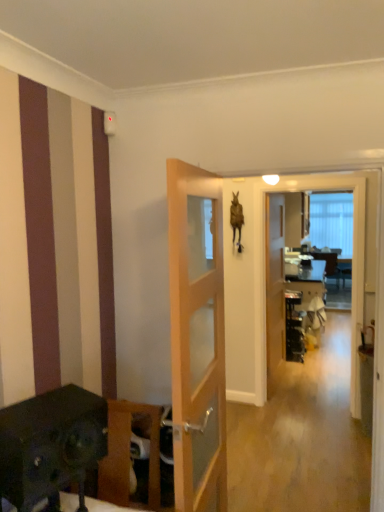
Measure the distance between point (215,317) and camera.

The depth of point (215,317) is 6.95 feet.

This screenshot has height=512, width=384. I want to click on wooden door at center, placed as the first door when sorted from back to front, so click(x=275, y=281).

Locate an element on the screen. The height and width of the screenshot is (512, 384). wooden cabinet at lower left is located at coordinates (128, 454).

Can you confirm if wooden door at center, the second door from the left, is wider than wooden cabinet at lower left?

Incorrect, the width of wooden door at center, the second door from the left, does not surpass that of wooden cabinet at lower left.

Is wooden door at center, placed as the first door when sorted from back to front, next to wooden cabinet at lower left?

No, wooden door at center, placed as the first door when sorted from back to front, is not beside wooden cabinet at lower left.

Is wooden door at center, placed as the first door when sorted from back to front, positioned with its back to wooden cabinet at lower left?

That's not correct — wooden door at center, placed as the first door when sorted from back to front, is not looking away from wooden cabinet at lower left.

Is light wood/glass door at center, marked as the first door in a left-to-right arrangement, facing towards transparent glass screen door at center?

No, light wood/glass door at center, marked as the first door in a left-to-right arrangement, is not aimed at transparent glass screen door at center.

This screenshot has width=384, height=512. Find the location of `the 2nd door to the left of the transparent glass screen door at center, counting from the anchor's position`. the 2nd door to the left of the transparent glass screen door at center, counting from the anchor's position is located at coordinates (197, 336).

From the picture: Between light wood/glass door at center, which is counted as the 2th door, starting from the right, and transparent glass screen door at center, which one appears on the right side from the viewer's perspective?

transparent glass screen door at center.

Would you say light wood/glass door at center, the 1th door when ordered from front to back, is inside or outside transparent glass screen door at center?

The correct answer is: outside.

Which of these two, wooden door at center, positioned as the 2th door in front-to-back order, or light wood/glass door at center, which appears as the second door when viewed from the back, is smaller?

wooden door at center, positioned as the 2th door in front-to-back order.

From a real-world perspective, relative to light wood/glass door at center, marked as the first door in a left-to-right arrangement, is wooden door at center, positioned as the 2th door in front-to-back order, vertically above or below?

Clearly, from a real-world perspective, wooden door at center, positioned as the 2th door in front-to-back order, is below light wood/glass door at center, marked as the first door in a left-to-right arrangement.

Between wooden door at center, placed as the first door when sorted from back to front, and light wood/glass door at center, which is counted as the 2th door, starting from the right, which one has more height?

wooden door at center, placed as the first door when sorted from back to front.

Looking at this image, can you tell me how much wooden door at center, placed as the first door when sorted from back to front, and light wood/glass door at center, the 1th door when ordered from front to back, differ in facing direction?

wooden door at center, placed as the first door when sorted from back to front, and light wood/glass door at center, the 1th door when ordered from front to back, are facing 11.3 degrees away from each other.

Is wooden door at center, positioned as the 2th door in front-to-back order, oriented away from transparent glass screen door at center?

No, wooden door at center, positioned as the 2th door in front-to-back order,'s orientation is not away from transparent glass screen door at center.

How different are the orientations of wooden door at center, the second door from the left, and transparent glass screen door at center in degrees?

wooden door at center, the second door from the left, and transparent glass screen door at center are facing 84.2 degrees away from each other.

Is point (280, 329) farther from viewer compared to point (362, 319)?

Yes, it is.

From a real-world perspective, which is physically below, wooden door at center, the 1th door positioned from the right, or transparent glass screen door at center?

From a 3D spatial view, wooden door at center, the 1th door positioned from the right, is below.

From a real-world perspective, who is located higher, wooden cabinet at lower left or light wood/glass door at center, marked as the first door in a left-to-right arrangement?

light wood/glass door at center, marked as the first door in a left-to-right arrangement, is physically above.

Does wooden cabinet at lower left appear on the right side of light wood/glass door at center, the 1th door when ordered from front to back?

Incorrect, wooden cabinet at lower left is not on the right side of light wood/glass door at center, the 1th door when ordered from front to back.

Is wooden cabinet at lower left looking in the opposite direction of light wood/glass door at center, the 1th door when ordered from front to back?

That's not correct — wooden cabinet at lower left is not looking away from light wood/glass door at center, the 1th door when ordered from front to back.

Identify the location of furniture behind the light wood/glass door at center, which appears as the second door when viewed from the back. This screenshot has width=384, height=512. (128, 454).

Based on the photo, could you measure the distance between wooden cabinet at lower left and wooden door at center, the 1th door positioned from the right?

wooden cabinet at lower left is 2.64 meters from wooden door at center, the 1th door positioned from the right.

I want to click on furniture on the left of the wooden door at center, positioned as the 2th door in front-to-back order, so pyautogui.click(x=128, y=454).

Looking at their sizes, would you say wooden cabinet at lower left is wider or thinner than wooden door at center, the 1th door positioned from the right?

Considering their sizes, wooden cabinet at lower left looks broader than wooden door at center, the 1th door positioned from the right.

Is wooden cabinet at lower left inside the boundaries of wooden door at center, the second door from the left, or outside?

wooden cabinet at lower left lies outside wooden door at center, the second door from the left.

Is light wood/glass door at center, which is counted as the 2th door, starting from the right, situated inside wooden cabinet at lower left or outside?

light wood/glass door at center, which is counted as the 2th door, starting from the right, exists outside the volume of wooden cabinet at lower left.

From the picture: Which point is more distant from viewer, (196,223) or (157,417)?

Positioned behind is point (157,417).

Considering the sizes of light wood/glass door at center, marked as the first door in a left-to-right arrangement, and wooden cabinet at lower left in the image, is light wood/glass door at center, marked as the first door in a left-to-right arrangement, wider or thinner than wooden cabinet at lower left?

Considering their sizes, light wood/glass door at center, marked as the first door in a left-to-right arrangement, looks slimmer than wooden cabinet at lower left.

Which object is positioned more to the right, light wood/glass door at center, marked as the first door in a left-to-right arrangement, or wooden cabinet at lower left?

From the viewer's perspective, light wood/glass door at center, marked as the first door in a left-to-right arrangement, appears more on the right side.

Find the location of a particular element. Image resolution: width=384 pixels, height=512 pixels. furniture located below the wooden door at center, positioned as the 2th door in front-to-back order (from the image's perspective) is located at coordinates (128, 454).

Where is `the 2nd door to the left of the transparent glass screen door at center, starting your count from the anchor`? the 2nd door to the left of the transparent glass screen door at center, starting your count from the anchor is located at coordinates (197, 336).

Estimate the real-world distances between objects in this image. Which object is further from transparent glass screen door at center, light wood/glass door at center, marked as the first door in a left-to-right arrangement, or wooden cabinet at lower left?

wooden cabinet at lower left lies further to transparent glass screen door at center than the other object.

Based on their spatial positions, is wooden cabinet at lower left or transparent glass screen door at center further from wooden door at center, positioned as the 2th door in front-to-back order?

Among the two, wooden cabinet at lower left is located further to wooden door at center, positioned as the 2th door in front-to-back order.

Estimate the real-world distances between objects in this image. Which object is closer to wooden cabinet at lower left, transparent glass screen door at center or wooden door at center, the 1th door positioned from the right?

transparent glass screen door at center is closer to wooden cabinet at lower left.

Based on their spatial positions, is wooden door at center, placed as the first door when sorted from back to front, or light wood/glass door at center, marked as the first door in a left-to-right arrangement, further from wooden cabinet at lower left?

Based on the image, wooden door at center, placed as the first door when sorted from back to front, appears to be further to wooden cabinet at lower left.

Based on the photo, which object lies nearer to the anchor point light wood/glass door at center, which is counted as the 2th door, starting from the right, transparent glass screen door at center or wooden door at center, placed as the first door when sorted from back to front?

The object closer to light wood/glass door at center, which is counted as the 2th door, starting from the right, is transparent glass screen door at center.

From the image, which object appears to be nearer to transparent glass screen door at center, wooden door at center, placed as the first door when sorted from back to front, or light wood/glass door at center, which appears as the second door when viewed from the back?

wooden door at center, placed as the first door when sorted from back to front, is positioned closer to the anchor transparent glass screen door at center.

Based on their spatial positions, is transparent glass screen door at center or wooden cabinet at lower left closer to wooden door at center, the 1th door positioned from the right?

Among the two, transparent glass screen door at center is located nearer to wooden door at center, the 1th door positioned from the right.

Considering their positions, is wooden door at center, positioned as the 2th door in front-to-back order, positioned closer to transparent glass screen door at center than wooden cabinet at lower left?

Among the two, wooden door at center, positioned as the 2th door in front-to-back order, is located nearer to transparent glass screen door at center.

Locate an element on the screen. Image resolution: width=384 pixels, height=512 pixels. furniture located between light wood/glass door at center, marked as the first door in a left-to-right arrangement, and transparent glass screen door at center in the depth direction is located at coordinates (128, 454).

This screenshot has width=384, height=512. Identify the location of furniture located between light wood/glass door at center, marked as the first door in a left-to-right arrangement, and wooden door at center, the second door from the left, in the depth direction. (128, 454).

What are the coordinates of `screen door between wooden cabinet at lower left and wooden door at center, positioned as the 2th door in front-to-back order, in the front-back direction` in the screenshot? It's located at (353, 254).

At what (x,y) coordinates should I click in order to perform the action: click on screen door located between light wood/glass door at center, the 1th door when ordered from front to back, and wooden door at center, positioned as the 2th door in front-to-back order, in the depth direction. Please return your answer as a coordinate pair (x, y). Looking at the image, I should click on (353, 254).